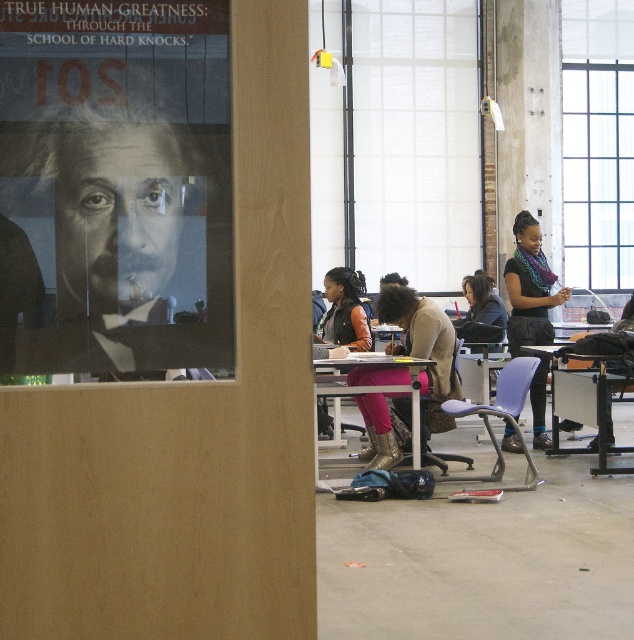
Who is more forward, (366, 460) or (456, 456)?

Positioned in front is point (456, 456).

Is matte pink pants at center wider than purple plastic chair at center?

Indeed, matte pink pants at center has a greater width compared to purple plastic chair at center.

Identify the location of matte pink pants at center. [x=422, y=340].

Consider the image. Which is more to the right, multicolored scarf at center or metallic silver table at lower right?

Positioned to the right is metallic silver table at lower right.

Does point (543, 292) come behind point (553, 346)?

No, it is in front of (553, 346).

Where is `multicolored scarf at center`? multicolored scarf at center is located at coordinates (529, 288).

Can you confirm if metallic silver table at lower right is positioned to the left of purple plastic chair at lower center?

No, metallic silver table at lower right is not to the left of purple plastic chair at lower center.

Measure the distance between point (592, 403) and camera.

Point (592, 403) is 8.61 meters away from camera.

Locate an element on the screen. Image resolution: width=634 pixels, height=640 pixels. metallic silver table at lower right is located at coordinates (583, 403).